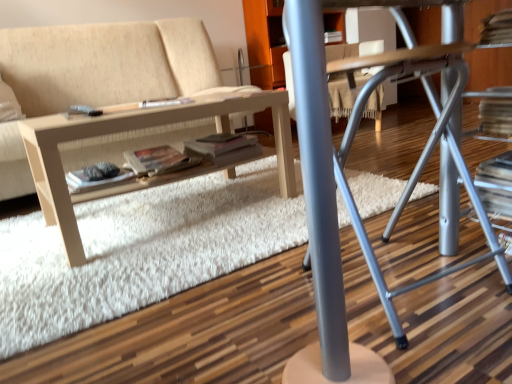
What are the coordinates of `vacant point above white shag rug at center (from a real-world perspective)` in the screenshot? It's located at click(150, 210).